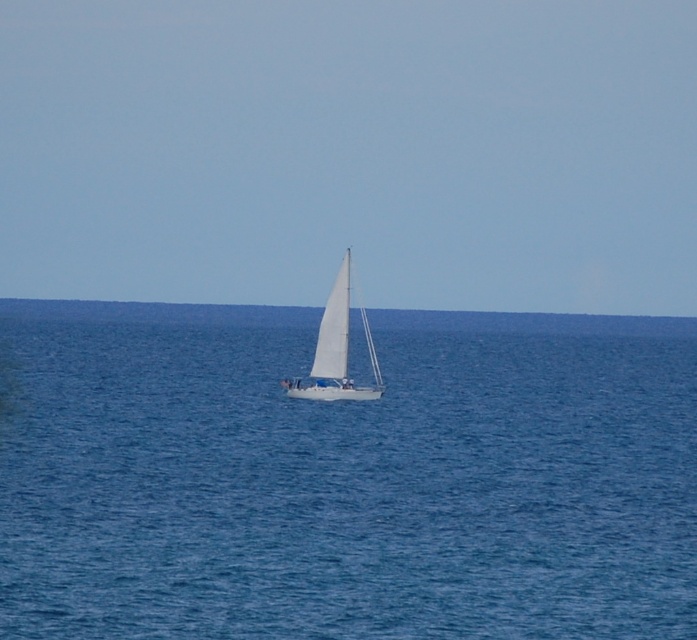
Does blue water at center come in front of white matte sailboat at center?

That is True.

In the scene shown: Can you confirm if blue water at center is positioned to the left of white matte sailboat at center?

In fact, blue water at center is to the right of white matte sailboat at center.

Where is `blue water at center`? This screenshot has height=640, width=697. blue water at center is located at coordinates (344, 476).